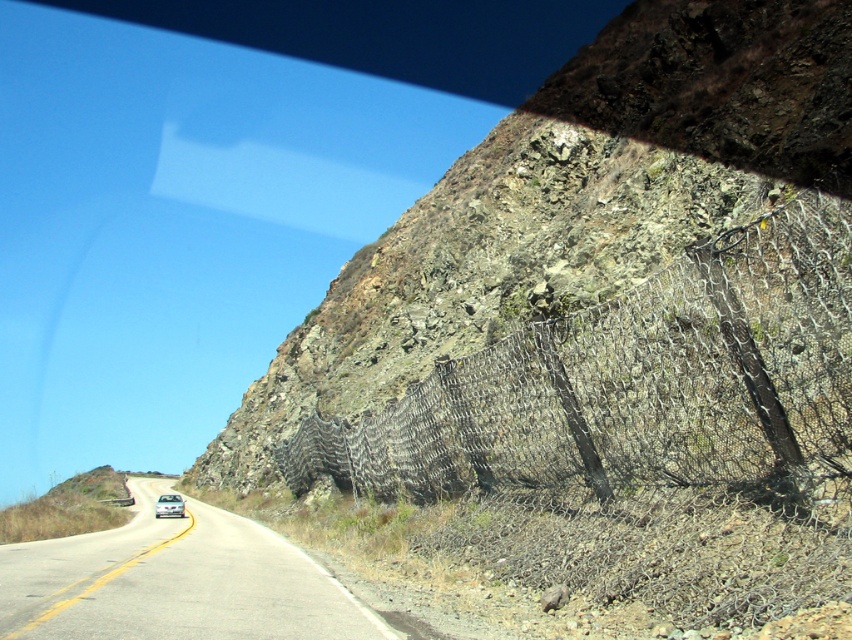
You are a driver approaching a sharp turn on the winding road. You notice the rugged stone mountain at center and the white asphalt road at center. Which object is positioned to the right side of the road? Please answer based on the scene.

The rugged stone mountain at center is to the right of the white asphalt road at center.

You are a passenger in the vehicle and looking out the window. You see the rusty wire mesh fence at upper right. Where is it located in terms of coordinates?

The rusty wire mesh fence at upper right is located at coordinates (x=643, y=429).

You are a driver approaching a sharp turn on the road. You notice the rugged stone mountain at center and the white asphalt road at center. Which one is wider?

The rugged stone mountain at center is wider than the white asphalt road at center.